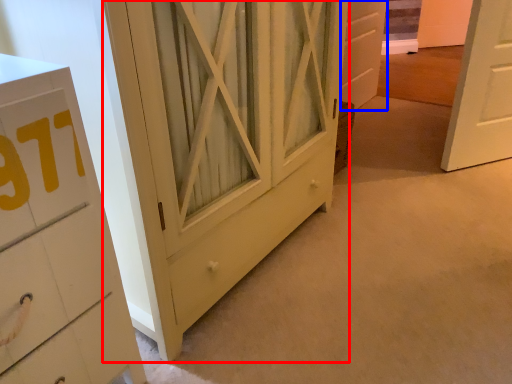
Question: Which point is closer to the camera, barn door (highlighted by a red box) or door (highlighted by a blue box)?

Choices:
 (A) barn door
 (B) door

Answer: (A)